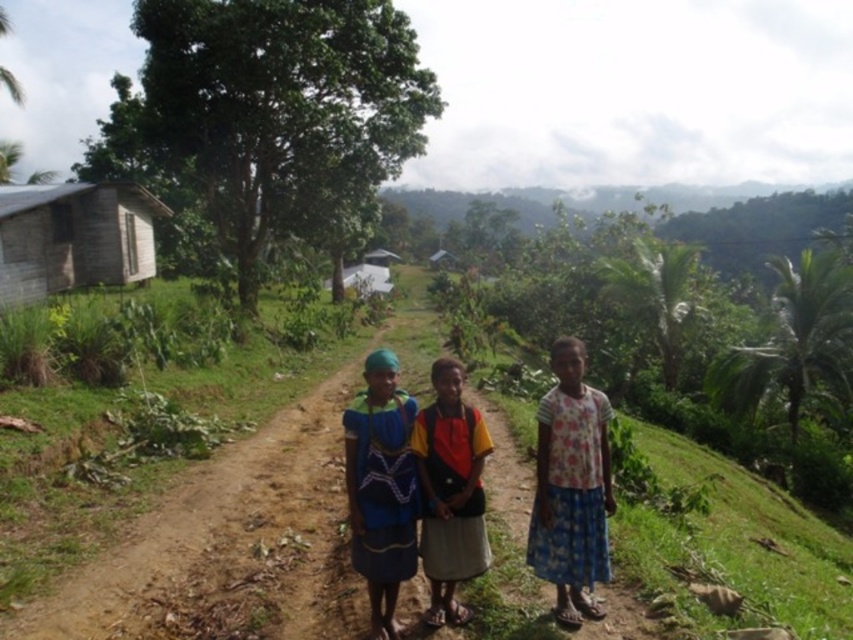
Who is positioned more to the left, blue woven fabric dress at center or multicolored fabric skirt at center?

From the viewer's perspective, blue woven fabric dress at center appears more on the left side.

Who is more forward, (372, 536) or (486, 449)?

Point (372, 536) is in front.

The width and height of the screenshot is (853, 640). I want to click on blue woven fabric dress at center, so click(x=381, y=488).

Is floral fabric skirt at center thinner than weathered wood hut at upper left?

Yes.

Who is higher up, floral fabric skirt at center or weathered wood hut at upper left?

weathered wood hut at upper left

Which is in front, point (554, 365) or point (131, 216)?

Positioned in front is point (554, 365).

This screenshot has height=640, width=853. I want to click on floral fabric skirt at center, so click(x=572, y=486).

Is weathered wood hut at upper left to the right of blue woven fabric dress at center from the viewer's perspective?

Incorrect, weathered wood hut at upper left is not on the right side of blue woven fabric dress at center.

Measure the distance between weathered wood hut at upper left and blue woven fabric dress at center.

weathered wood hut at upper left and blue woven fabric dress at center are 20.04 meters apart from each other.

Measure the distance between weathered wood hut at upper left and camera.

They are 13.65 meters apart.

The image size is (853, 640). I want to click on weathered wood hut at upper left, so click(74, 237).